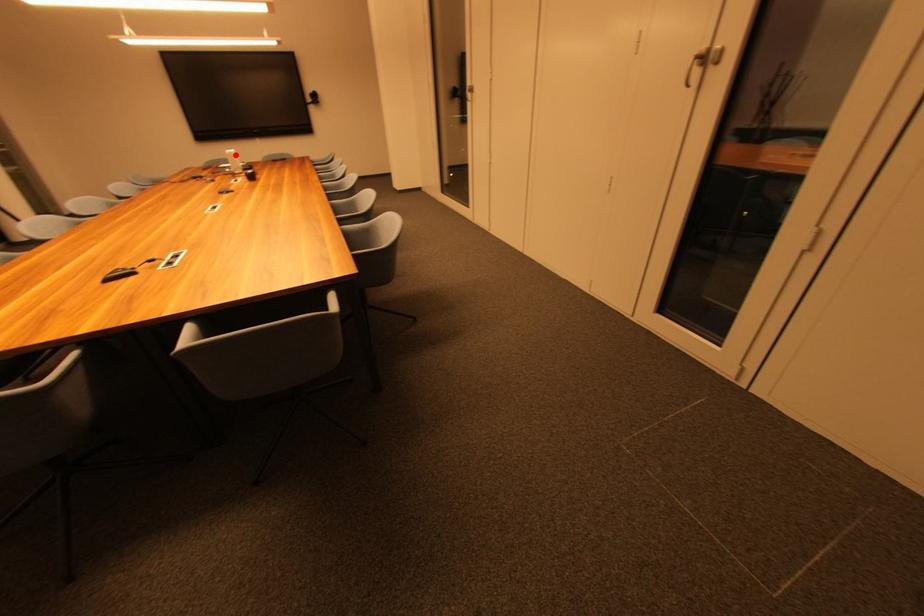
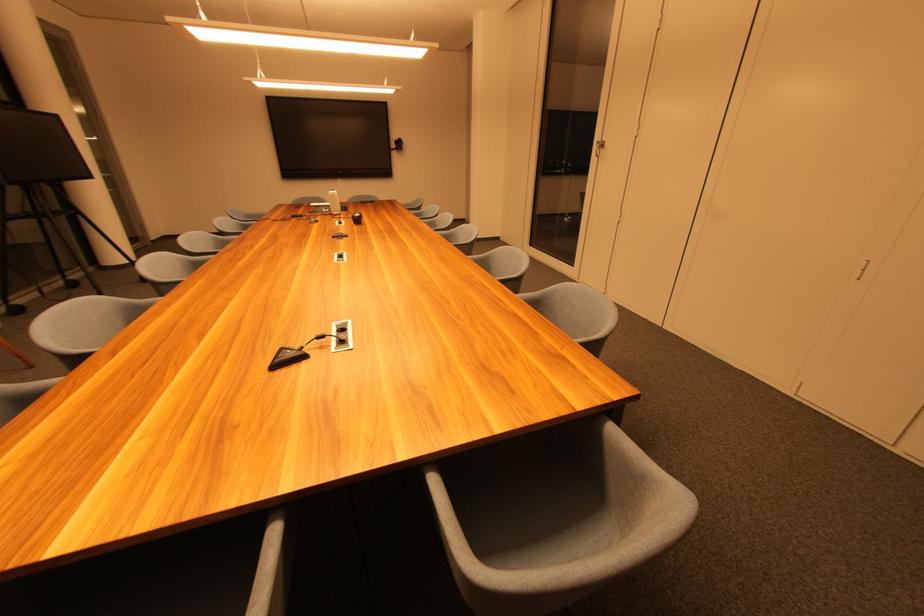
In the second image, find the point that corresponds to the highlighted location in the first image.

(337, 196)